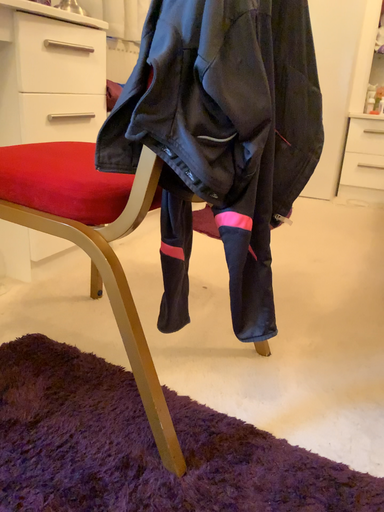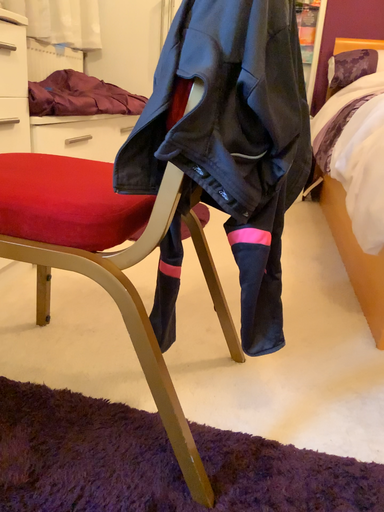
Question: Which way did the camera rotate in the video?

Choices:
 (A) rotated right
 (B) rotated left

Answer: (A)